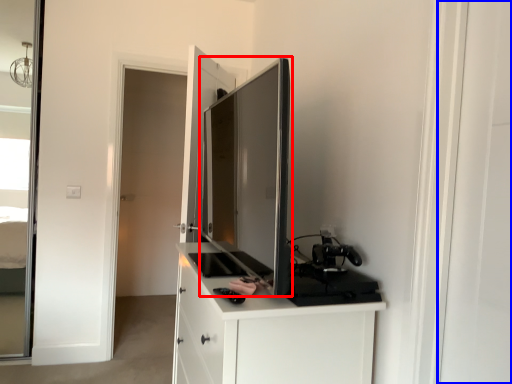
Question: Which object appears closest to the camera in this image, appliance (highlighted by a red box) or screen door (highlighted by a blue box)?

Choices:
 (A) appliance
 (B) screen door

Answer: (B)